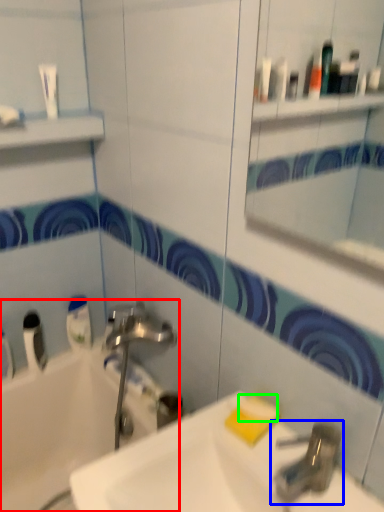
Question: Which is farther away from bathtub (highlighted by a red box)? tap (highlighted by a blue box) or soap (highlighted by a green box)?

Choices:
 (A) tap
 (B) soap

Answer: (A)